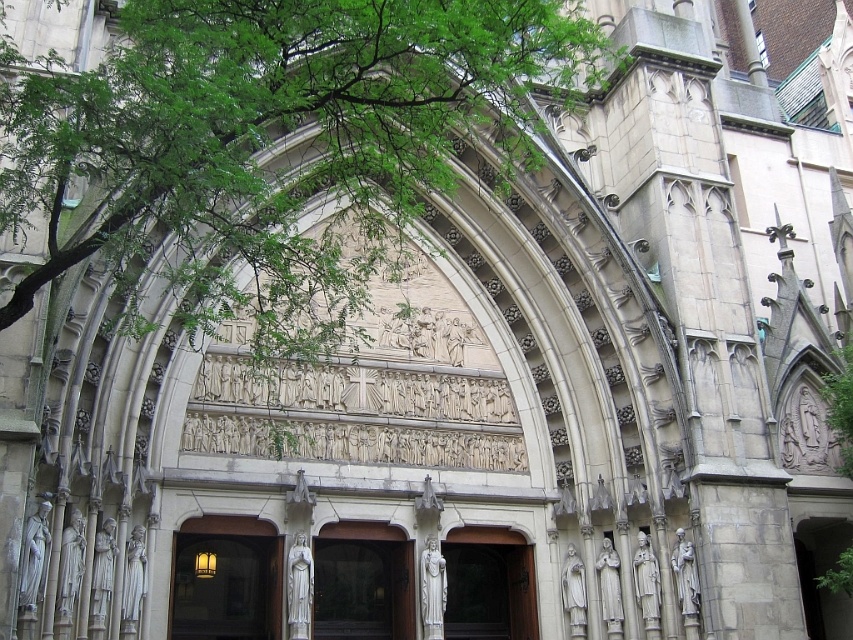
Consider the image. You are an architect examining the church facade. You notice two arches at the center. Which one is closer to you, the smooth stone archway at center or the white stone arch at center?

The smooth stone archway at center is closer to you because it is in front of the white stone arch at center.

You are standing in front of the Gothic church and notice a green leafy tree at upper left and a white stone arch at center. Which object appears taller in the image?

The green leafy tree at upper left is taller than the white stone arch at center according to the description.